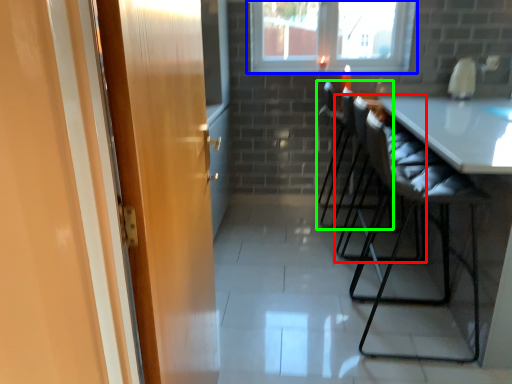
Question: Considering the real-world distances, which object is farthest from chair (highlighted by a red box)? window (highlighted by a blue box) or chair (highlighted by a green box)?

Choices:
 (A) window
 (B) chair

Answer: (A)